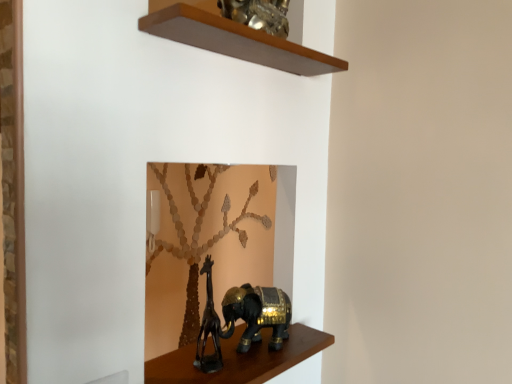
The height and width of the screenshot is (384, 512). What do you see at coordinates (257, 314) in the screenshot? I see `gold metallic elephant at center` at bounding box center [257, 314].

Image resolution: width=512 pixels, height=384 pixels. What are the coordinates of `gold metallic elephant at center` in the screenshot? It's located at (257, 314).

Between wooden shelf at upper center, placed as the 1th shelf when sorted from top to bottom, and shiny black elephant at lower center, which is the 1th shelf in bottom-to-top order, which one has more height?

wooden shelf at upper center, placed as the 1th shelf when sorted from top to bottom.

Looking at this image, how many degrees apart are the facing directions of wooden shelf at upper center, which is counted as the 2th shelf, starting from the bottom, and shiny black elephant at lower center, the 2th shelf when ordered from top to bottom?

There is a 0.000163-degree angle between the facing directions of wooden shelf at upper center, which is counted as the 2th shelf, starting from the bottom, and shiny black elephant at lower center, the 2th shelf when ordered from top to bottom.

Which object is positioned more to the left, wooden shelf at upper center, placed as the 1th shelf when sorted from top to bottom, or shiny black elephant at lower center, the 2th shelf when ordered from top to bottom?

shiny black elephant at lower center, the 2th shelf when ordered from top to bottom, is more to the left.

Looking at their sizes, would you say wooden shelf at upper center, placed as the 1th shelf when sorted from top to bottom, is wider or thinner than shiny black elephant at lower center, the 2th shelf when ordered from top to bottom?

In the image, wooden shelf at upper center, placed as the 1th shelf when sorted from top to bottom, appears to be wider than shiny black elephant at lower center, the 2th shelf when ordered from top to bottom.

From the image's perspective, is black matte giraffe at lower center below gold metallic elephant at center?

No, from the image's perspective, black matte giraffe at lower center is not below gold metallic elephant at center.

Could you tell me if black matte giraffe at lower center is turned towards gold metallic elephant at center?

No, black matte giraffe at lower center is not facing towards gold metallic elephant at center.

Considering the relative sizes of black matte giraffe at lower center and gold metallic elephant at center in the image provided, is black matte giraffe at lower center smaller than gold metallic elephant at center?

Yes.

Is black matte giraffe at lower center located outside gold metallic elephant at center?

black matte giraffe at lower center lies outside gold metallic elephant at center's area.

From the image's perspective, which is below, shiny black elephant at lower center, the 2th shelf when ordered from top to bottom, or wooden shelf at upper center, placed as the 1th shelf when sorted from top to bottom?

shiny black elephant at lower center, the 2th shelf when ordered from top to bottom, appears lower in the image.

Are shiny black elephant at lower center, which is the 1th shelf in bottom-to-top order, and wooden shelf at upper center, placed as the 1th shelf when sorted from top to bottom, making contact?

No, shiny black elephant at lower center, which is the 1th shelf in bottom-to-top order, is not making contact with wooden shelf at upper center, placed as the 1th shelf when sorted from top to bottom.

Which point is more forward, (x=160, y=382) or (x=239, y=33)?

Point (x=239, y=33)

The width and height of the screenshot is (512, 384). What are the coordinates of `shelf behind the wooden shelf at upper center, placed as the 1th shelf when sorted from top to bottom` in the screenshot? It's located at (239, 359).

Looking at this image, from the image's perspective, between black matte giraffe at lower center and wooden shelf at upper center, placed as the 1th shelf when sorted from top to bottom, who is located below?

From the image's view, black matte giraffe at lower center is below.

Is wooden shelf at upper center, which is counted as the 2th shelf, starting from the bottom, a part of black matte giraffe at lower center?

Actually, wooden shelf at upper center, which is counted as the 2th shelf, starting from the bottom, is outside black matte giraffe at lower center.

Is black matte giraffe at lower center to the left of wooden shelf at upper center, placed as the 1th shelf when sorted from top to bottom, from the viewer's perspective?

Yes.

Could you tell me if black matte giraffe at lower center is turned towards wooden shelf at upper center, placed as the 1th shelf when sorted from top to bottom?

No, black matte giraffe at lower center is not turned towards wooden shelf at upper center, placed as the 1th shelf when sorted from top to bottom.

Can you tell me how much gold metallic elephant at center and black matte giraffe at lower center differ in facing direction?

There is a 0.0757-degree angle between the facing directions of gold metallic elephant at center and black matte giraffe at lower center.

From the image's perspective, which is above, gold metallic elephant at center or black matte giraffe at lower center?

black matte giraffe at lower center.

Does gold metallic elephant at center have a lesser height compared to black matte giraffe at lower center?

Yes, gold metallic elephant at center is shorter than black matte giraffe at lower center.

Which is behind, point (267, 321) or point (217, 329)?

The point (267, 321) is farther.

From a real-world perspective, relative to shiny black elephant at lower center, the 2th shelf when ordered from top to bottom, is gold metallic elephant at center vertically above or below?

Clearly, from a real-world perspective, gold metallic elephant at center is above shiny black elephant at lower center, the 2th shelf when ordered from top to bottom.

Who is smaller, gold metallic elephant at center or shiny black elephant at lower center, the 2th shelf when ordered from top to bottom?

With smaller size is shiny black elephant at lower center, the 2th shelf when ordered from top to bottom.

Could you measure the distance between gold metallic elephant at center and shiny black elephant at lower center, which is the 1th shelf in bottom-to-top order?

gold metallic elephant at center and shiny black elephant at lower center, which is the 1th shelf in bottom-to-top order, are 2.30 inches apart.

Is gold metallic elephant at center with shiny black elephant at lower center, the 2th shelf when ordered from top to bottom?

Yes, the surface of gold metallic elephant at center is in contact with shiny black elephant at lower center, the 2th shelf when ordered from top to bottom.

Is wooden shelf at upper center, placed as the 1th shelf when sorted from top to bottom, positioned with its back to gold metallic elephant at center?

wooden shelf at upper center, placed as the 1th shelf when sorted from top to bottom, is not turned away from gold metallic elephant at center.

What's the angular difference between wooden shelf at upper center, which is counted as the 2th shelf, starting from the bottom, and gold metallic elephant at center's facing directions?

There is a 0.131-degree angle between the facing directions of wooden shelf at upper center, which is counted as the 2th shelf, starting from the bottom, and gold metallic elephant at center.

In the scene shown: Does wooden shelf at upper center, placed as the 1th shelf when sorted from top to bottom, have a greater width compared to gold metallic elephant at center?

Yes, wooden shelf at upper center, placed as the 1th shelf when sorted from top to bottom, is wider than gold metallic elephant at center.

Would you consider wooden shelf at upper center, which is counted as the 2th shelf, starting from the bottom, to be distant from gold metallic elephant at center?

No, wooden shelf at upper center, which is counted as the 2th shelf, starting from the bottom, is not far away from gold metallic elephant at center.

Find the location of a particular element. The height and width of the screenshot is (384, 512). shelf above the shiny black elephant at lower center, the 2th shelf when ordered from top to bottom (from a real-world perspective) is located at coordinates (236, 40).

What are the coordinates of `animal sculpture that appears in front of the gold metallic elephant at center` in the screenshot? It's located at (209, 328).

Considering their positions, is shiny black elephant at lower center, which is the 1th shelf in bottom-to-top order, positioned further to wooden shelf at upper center, placed as the 1th shelf when sorted from top to bottom, than black matte giraffe at lower center?

shiny black elephant at lower center, which is the 1th shelf in bottom-to-top order, lies further to wooden shelf at upper center, placed as the 1th shelf when sorted from top to bottom, than the other object.

From the image, which object appears to be farther from shiny black elephant at lower center, which is the 1th shelf in bottom-to-top order, gold metallic elephant at center or wooden shelf at upper center, which is counted as the 2th shelf, starting from the bottom?

wooden shelf at upper center, which is counted as the 2th shelf, starting from the bottom, is further to shiny black elephant at lower center, which is the 1th shelf in bottom-to-top order.

Considering their positions, is shiny black elephant at lower center, which is the 1th shelf in bottom-to-top order, positioned further to gold metallic elephant at center than black matte giraffe at lower center?

Based on the image, black matte giraffe at lower center appears to be further to gold metallic elephant at center.

In the scene shown: When comparing their distances from gold metallic elephant at center, does black matte giraffe at lower center or shiny black elephant at lower center, which is the 1th shelf in bottom-to-top order, seem further?

The object further to gold metallic elephant at center is black matte giraffe at lower center.

Considering their positions, is wooden shelf at upper center, placed as the 1th shelf when sorted from top to bottom, positioned closer to black matte giraffe at lower center than shiny black elephant at lower center, the 2th shelf when ordered from top to bottom?

Among the two, shiny black elephant at lower center, the 2th shelf when ordered from top to bottom, is located nearer to black matte giraffe at lower center.

From the image, which object appears to be nearer to black matte giraffe at lower center, shiny black elephant at lower center, the 2th shelf when ordered from top to bottom, or gold metallic elephant at center?

→ Based on the image, gold metallic elephant at center appears to be nearer to black matte giraffe at lower center.

Estimate the real-world distances between objects in this image. Which object is further from wooden shelf at upper center, which is counted as the 2th shelf, starting from the bottom, gold metallic elephant at center or black matte giraffe at lower center?

black matte giraffe at lower center is further to wooden shelf at upper center, which is counted as the 2th shelf, starting from the bottom.

When comparing their distances from wooden shelf at upper center, which is counted as the 2th shelf, starting from the bottom, does shiny black elephant at lower center, which is the 1th shelf in bottom-to-top order, or gold metallic elephant at center seem closer?

Based on the image, gold metallic elephant at center appears to be nearer to wooden shelf at upper center, which is counted as the 2th shelf, starting from the bottom.

At what (x,y) coordinates should I click in order to perform the action: click on animal sculpture between wooden shelf at upper center, placed as the 1th shelf when sorted from top to bottom, and shiny black elephant at lower center, the 2th shelf when ordered from top to bottom, vertically. Please return your answer as a coordinate pair (x, y). This screenshot has height=384, width=512. Looking at the image, I should click on (209, 328).

I want to click on animal sculpture between shiny black elephant at lower center, the 2th shelf when ordered from top to bottom, and gold metallic elephant at center, along the z-axis, so click(209, 328).

Identify the location of elephant between wooden shelf at upper center, placed as the 1th shelf when sorted from top to bottom, and shiny black elephant at lower center, the 2th shelf when ordered from top to bottom, in the up-down direction. Image resolution: width=512 pixels, height=384 pixels. (257, 314).

Where is `animal sculpture that lies between wooden shelf at upper center, which is counted as the 2th shelf, starting from the bottom, and gold metallic elephant at center from top to bottom`? Image resolution: width=512 pixels, height=384 pixels. animal sculpture that lies between wooden shelf at upper center, which is counted as the 2th shelf, starting from the bottom, and gold metallic elephant at center from top to bottom is located at coordinates (209, 328).